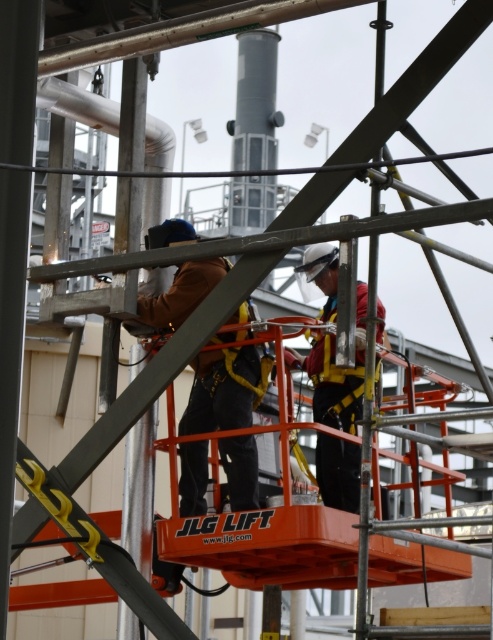
Question: From the image, what is the correct spatial relationship of brown leather jacket at center in relation to matte white helmet at center?

Choices:
 (A) left
 (B) right

Answer: (A)

Question: In this image, where is brown leather jacket at center located relative to matte white helmet at center?

Choices:
 (A) below
 (B) above

Answer: (B)

Question: Which point is closer to the camera?

Choices:
 (A) matte white helmet at center
 (B) brown leather jacket at center

Answer: (A)

Question: Is brown leather jacket at center below matte white helmet at center?

Choices:
 (A) yes
 (B) no

Answer: (B)